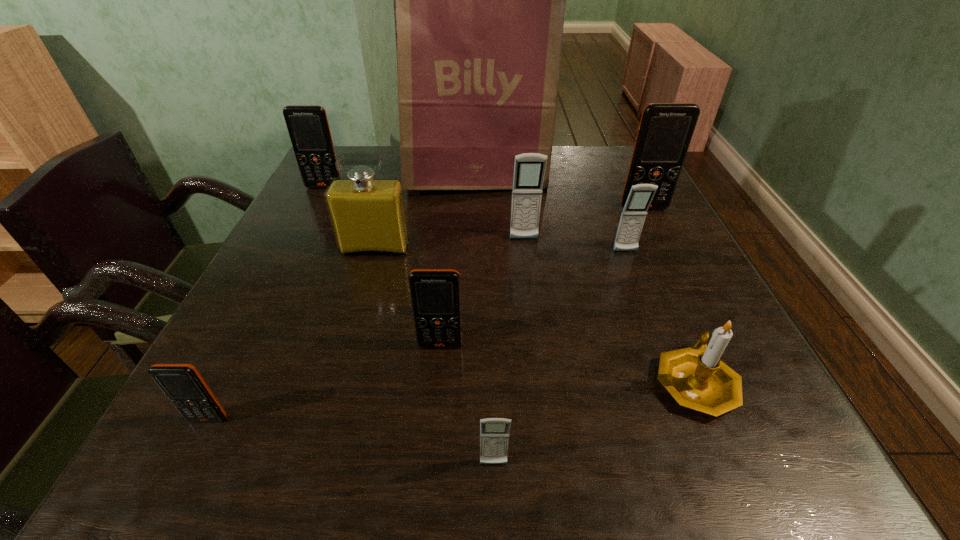
The image size is (960, 540). I want to click on free space between the candle holder and the biggest gray cellular telephone, so click(x=610, y=310).

You are a GUI agent. You are given a task and a screenshot of the screen. Output one action in this format:
    pyautogui.click(x=<x>, y=<y>)
    Task: Click on the free spot between the farthest orange cellular telephone and the second cellular telephone from right to left
    This screenshot has height=540, width=960.
    Given the screenshot: What is the action you would take?
    pyautogui.click(x=475, y=219)

You are a GUI agent. You are given a task and a screenshot of the screen. Output one action in this format:
    pyautogui.click(x=<x>, y=<y>)
    Task: Click on the vacant area that lies between the leftmost gray cellular telephone and the gold candle holder
    
    Given the screenshot: What is the action you would take?
    pyautogui.click(x=594, y=423)

You are a GUI agent. You are given a task and a screenshot of the screen. Output one action in this format:
    pyautogui.click(x=<x>, y=<y>)
    Task: Click on the vacant area that lies between the second biggest orange cellular telephone and the smallest orange cellular telephone
    This screenshot has height=540, width=960.
    Given the screenshot: What is the action you would take?
    pyautogui.click(x=266, y=303)

You are a GUI agent. You are given a task and a screenshot of the screen. Output one action in this format:
    pyautogui.click(x=<x>, y=<y>)
    Task: Click on the empty location between the grocery bag and the fifth farthest cellular telephone
    The height and width of the screenshot is (540, 960).
    Given the screenshot: What is the action you would take?
    pyautogui.click(x=458, y=260)

Identify the location of free space between the smallest orange cellular telephone and the candle holder. click(x=451, y=400).

At what (x,y) coordinates should I click in order to perform the action: click on free space that is in between the fourth farthest cellular telephone and the tallest object. Please return your answer as a coordinate pair (x, y). The width and height of the screenshot is (960, 540). Looking at the image, I should click on (550, 213).

Image resolution: width=960 pixels, height=540 pixels. Find the location of `free space between the gold candle holder and the second smallest gray cellular telephone`. free space between the gold candle holder and the second smallest gray cellular telephone is located at coordinates (660, 316).

Point out which object is positioned as the ninth nearest to the nearest orange cellular telephone. Please provide its 2D coordinates. Your answer should be formatted as a tuple, i.e. [(x, y)], where the tuple contains the x and y coordinates of a point satisfying the conditions above.

[(665, 131)]

Select which object is the seventh closest to the second nearest orange cellular telephone. Please provide its 2D coordinates. Your answer should be formatted as a tuple, i.e. [(x, y)], where the tuple contains the x and y coordinates of a point satisfying the conditions above.

[(479, 0)]